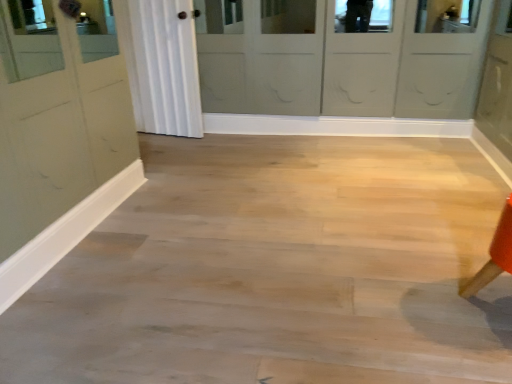
This screenshot has height=384, width=512. Describe the element at coordinates (65, 234) in the screenshot. I see `white smooth baseboard at lower left` at that location.

Locate an element on the screen. white smooth baseboard at lower left is located at coordinates (65, 234).

Where is `white smooth baseboard at lower left`? This screenshot has height=384, width=512. white smooth baseboard at lower left is located at coordinates (65, 234).